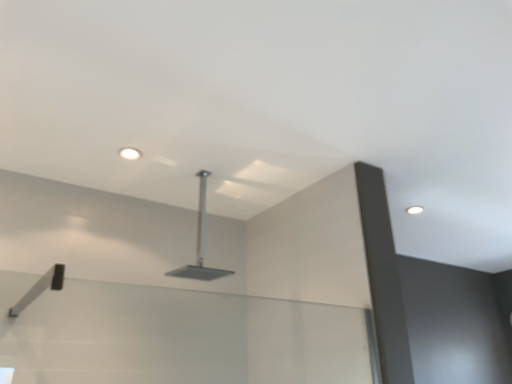
The width and height of the screenshot is (512, 384). What do you see at coordinates (414, 210) in the screenshot?
I see `white glossy droplight at upper right, positioned as the second droplight in top-to-bottom order` at bounding box center [414, 210].

Describe the element at coordinates (130, 153) in the screenshot. I see `matte white droplight at upper center, which ranks as the 1th droplight in front-to-back order` at that location.

The height and width of the screenshot is (384, 512). I want to click on satin silver showerhead at center, so click(x=200, y=243).

Which object is thinner, satin silver showerhead at center or matte white droplight at upper center, which ranks as the 2th droplight in bottom-to-top order?

matte white droplight at upper center, which ranks as the 2th droplight in bottom-to-top order.

Considering the positions of objects satin silver showerhead at center and matte white droplight at upper center, which ranks as the 1th droplight in front-to-back order, in the image provided, who is more to the left, satin silver showerhead at center or matte white droplight at upper center, which ranks as the 1th droplight in front-to-back order,?

matte white droplight at upper center, which ranks as the 1th droplight in front-to-back order.

How much distance is there between satin silver showerhead at center and matte white droplight at upper center, placed as the 1th droplight when sorted from left to right?

satin silver showerhead at center and matte white droplight at upper center, placed as the 1th droplight when sorted from left to right, are 21.52 inches apart.

How different are the orientations of satin silver showerhead at center and matte white droplight at upper center, the second droplight viewed from the right, in degrees?

satin silver showerhead at center and matte white droplight at upper center, the second droplight viewed from the right, are facing 4.78 degrees away from each other.

Is matte white droplight at upper center, placed as the 1th droplight when sorted from left to right, at the left side of satin silver showerhead at center?

Correct, you'll find matte white droplight at upper center, placed as the 1th droplight when sorted from left to right, to the left of satin silver showerhead at center.

Image resolution: width=512 pixels, height=384 pixels. In order to click on droplight that is the 1st object located behind the satin silver showerhead at center in this screenshot , I will do `click(130, 153)`.

Between matte white droplight at upper center, acting as the 2th droplight starting from the back, and satin silver showerhead at center, which one is positioned behind?

matte white droplight at upper center, acting as the 2th droplight starting from the back, is behind.

Considering the sizes of objects matte white droplight at upper center, the 1th droplight viewed from the top, and satin silver showerhead at center in the image provided, who is shorter, matte white droplight at upper center, the 1th droplight viewed from the top, or satin silver showerhead at center?

→ matte white droplight at upper center, the 1th droplight viewed from the top.

Which of these two, matte white droplight at upper center, acting as the 2th droplight starting from the back, or white glossy droplight at upper right, which ranks as the 1th droplight in back-to-front order, is bigger?

white glossy droplight at upper right, which ranks as the 1th droplight in back-to-front order, is bigger.

From the image's perspective, is matte white droplight at upper center, which ranks as the 1th droplight in front-to-back order, positioned above or below white glossy droplight at upper right, positioned as the second droplight in top-to-bottom order?

matte white droplight at upper center, which ranks as the 1th droplight in front-to-back order, is above white glossy droplight at upper right, positioned as the second droplight in top-to-bottom order.

Does matte white droplight at upper center, acting as the 2th droplight starting from the back, have a lesser height compared to white glossy droplight at upper right, positioned as the second droplight in top-to-bottom order?

Incorrect, the height of matte white droplight at upper center, acting as the 2th droplight starting from the back, does not fall short of that of white glossy droplight at upper right, positioned as the second droplight in top-to-bottom order.

In the scene shown: Does matte white droplight at upper center, the second droplight viewed from the right, appear on the left side of white glossy droplight at upper right, which is the 1th droplight from bottom to top?

Yes, matte white droplight at upper center, the second droplight viewed from the right, is to the left of white glossy droplight at upper right, which is the 1th droplight from bottom to top.

Considering the sizes of satin silver showerhead at center and white glossy droplight at upper right, acting as the 1th droplight starting from the right, in the image, is satin silver showerhead at center bigger or smaller than white glossy droplight at upper right, acting as the 1th droplight starting from the right,?

In the image, satin silver showerhead at center appears to be larger than white glossy droplight at upper right, acting as the 1th droplight starting from the right.

From the image's perspective, which is above, satin silver showerhead at center or white glossy droplight at upper right, placed as the 2th droplight when sorted from left to right?

white glossy droplight at upper right, placed as the 2th droplight when sorted from left to right.

Considering the sizes of satin silver showerhead at center and white glossy droplight at upper right, which is the 1th droplight from bottom to top, in the image, is satin silver showerhead at center taller or shorter than white glossy droplight at upper right, which is the 1th droplight from bottom to top,?

Considering their sizes, satin silver showerhead at center has more height than white glossy droplight at upper right, which is the 1th droplight from bottom to top.

Considering the positions of objects white glossy droplight at upper right, which ranks as the 1th droplight in back-to-front order, and matte white droplight at upper center, acting as the 2th droplight starting from the back, in the image provided, who is more to the right, white glossy droplight at upper right, which ranks as the 1th droplight in back-to-front order, or matte white droplight at upper center, acting as the 2th droplight starting from the back,?

From the viewer's perspective, white glossy droplight at upper right, which ranks as the 1th droplight in back-to-front order, appears more on the right side.

Considering the sizes of objects white glossy droplight at upper right, which ranks as the 1th droplight in back-to-front order, and matte white droplight at upper center, which ranks as the 2th droplight in bottom-to-top order, in the image provided, who is bigger, white glossy droplight at upper right, which ranks as the 1th droplight in back-to-front order, or matte white droplight at upper center, which ranks as the 2th droplight in bottom-to-top order,?

white glossy droplight at upper right, which ranks as the 1th droplight in back-to-front order.

What's the angular difference between white glossy droplight at upper right, acting as the 1th droplight starting from the right, and matte white droplight at upper center, acting as the 2th droplight starting from the back,'s facing directions?

The angular difference between white glossy droplight at upper right, acting as the 1th droplight starting from the right, and matte white droplight at upper center, acting as the 2th droplight starting from the back, is 3.07 degrees.

Is white glossy droplight at upper right, which ranks as the 1th droplight in back-to-front order, turned away from satin silver showerhead at center?

white glossy droplight at upper right, which ranks as the 1th droplight in back-to-front order, does not have its back to satin silver showerhead at center.

Is point (410, 210) more distant than point (204, 197)?

Yes, it is behind point (204, 197).

Who is shorter, white glossy droplight at upper right, placed as the 2th droplight when sorted from left to right, or satin silver showerhead at center?

white glossy droplight at upper right, placed as the 2th droplight when sorted from left to right.

From a real-world perspective, is white glossy droplight at upper right, which appears as the 2th droplight when viewed from the front, physically located above or below satin silver showerhead at center?

white glossy droplight at upper right, which appears as the 2th droplight when viewed from the front, is situated higher than satin silver showerhead at center in the real world.

This screenshot has height=384, width=512. I want to click on lamp below the matte white droplight at upper center, the 1th droplight viewed from the top (from a real-world perspective), so click(x=200, y=243).

Find the location of a particular element. lamp in front of the matte white droplight at upper center, acting as the 2th droplight starting from the back is located at coordinates (200, 243).

Looking at the image, which one is located closer to white glossy droplight at upper right, positioned as the second droplight in top-to-bottom order, matte white droplight at upper center, acting as the 2th droplight starting from the back, or satin silver showerhead at center?

The object closer to white glossy droplight at upper right, positioned as the second droplight in top-to-bottom order, is satin silver showerhead at center.

Based on their spatial positions, is matte white droplight at upper center, the 1th droplight viewed from the top, or white glossy droplight at upper right, placed as the 2th droplight when sorted from left to right, closer to satin silver showerhead at center?

matte white droplight at upper center, the 1th droplight viewed from the top, is closer to satin silver showerhead at center.

Based on the photo, looking at the image, which one is located closer to matte white droplight at upper center, the second droplight viewed from the right, satin silver showerhead at center or white glossy droplight at upper right, which ranks as the 1th droplight in back-to-front order?

Among the two, satin silver showerhead at center is located nearer to matte white droplight at upper center, the second droplight viewed from the right.

Estimate the real-world distances between objects in this image. Which object is further from matte white droplight at upper center, which ranks as the 1th droplight in front-to-back order, white glossy droplight at upper right, placed as the 2th droplight when sorted from left to right, or satin silver showerhead at center?

white glossy droplight at upper right, placed as the 2th droplight when sorted from left to right, lies further to matte white droplight at upper center, which ranks as the 1th droplight in front-to-back order, than the other object.

Estimate the real-world distances between objects in this image. Which object is further from white glossy droplight at upper right, positioned as the second droplight in top-to-bottom order, satin silver showerhead at center or matte white droplight at upper center, which ranks as the 1th droplight in front-to-back order?

The object further to white glossy droplight at upper right, positioned as the second droplight in top-to-bottom order, is matte white droplight at upper center, which ranks as the 1th droplight in front-to-back order.

Estimate the real-world distances between objects in this image. Which object is further from satin silver showerhead at center, white glossy droplight at upper right, which appears as the 2th droplight when viewed from the front, or matte white droplight at upper center, the 1th droplight viewed from the top?

white glossy droplight at upper right, which appears as the 2th droplight when viewed from the front.

Find the location of a particular element. The image size is (512, 384). lamp between matte white droplight at upper center, acting as the 2th droplight starting from the back, and white glossy droplight at upper right, placed as the 2th droplight when sorted from left to right, from left to right is located at coordinates (200, 243).